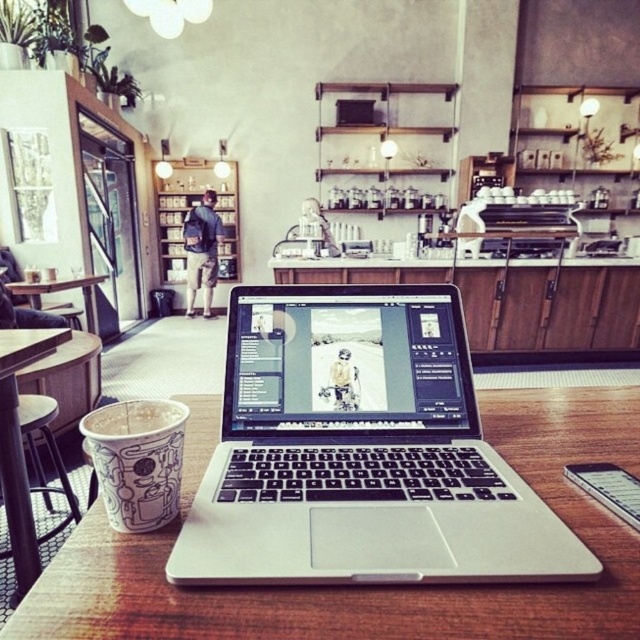
You are a barista preparing drinks for customers. You have two cups in front of you, the white paper cup at center and the white matte cup at lower left. Which cup can hold more liquid based on their sizes?

The white paper cup at center is larger in size than the white matte cup at lower left, so it can hold more liquid.

You are a barista who needs to place a new coffee cup on the wooden table at center. The cup you have is 10 inches in diameter. Can you fit it on the table without touching the white paper cup at center?

The wooden table at center is 10.64 inches away from white paper cup at center. Since the cup is 10 inches in diameter, there is enough space between them to place the new cup without touching the existing one.

In the scene shown: You are a barista in the cafe and need to place a new cup on the table without moving the silver metallic laptop at center or the white matte cup at lower left. Where should you place the new cup?

The silver metallic laptop at center is located below the white matte cup at lower left, so the new cup should be placed in an area that doesn not interfere with their current positions, possibly to the side or behind the existing objects.